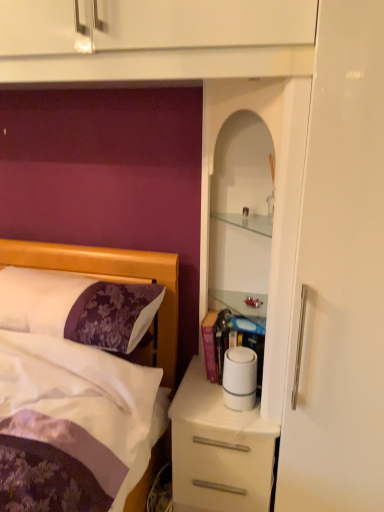
Question: From a real-world perspective, is white glossy cabinet at upper right physically above white matte toilet paper at center?

Choices:
 (A) yes
 (B) no

Answer: (A)

Question: Does white glossy cabinet at upper right lie behind white matte toilet paper at center?

Choices:
 (A) yes
 (B) no

Answer: (B)

Question: Can you confirm if white glossy cabinet at upper right is bigger than white matte toilet paper at center?

Choices:
 (A) yes
 (B) no

Answer: (A)

Question: Does white glossy cabinet at upper right have a greater width compared to white matte toilet paper at center?

Choices:
 (A) no
 (B) yes

Answer: (B)

Question: From the image's perspective, would you say white glossy cabinet at upper right is shown under white matte toilet paper at center?

Choices:
 (A) no
 (B) yes

Answer: (A)

Question: From the image's perspective, is purple satin pillow at left above or below white glossy desk at center?

Choices:
 (A) below
 (B) above

Answer: (B)

Question: Is purple satin pillow at left to the left or to the right of white glossy desk at center in the image?

Choices:
 (A) left
 (B) right

Answer: (A)

Question: In terms of width, does purple satin pillow at left look wider or thinner when compared to white glossy desk at center?

Choices:
 (A) thin
 (B) wide

Answer: (A)

Question: Is purple satin pillow at left in front of or behind white glossy desk at center in the image?

Choices:
 (A) front
 (B) behind

Answer: (A)

Question: In the image, is purple satin pillow at left positioned in front of or behind white matte toilet paper at center?

Choices:
 (A) front
 (B) behind

Answer: (A)

Question: From the image's perspective, is purple satin pillow at left positioned above or below white matte toilet paper at center?

Choices:
 (A) above
 (B) below

Answer: (A)

Question: Is purple satin pillow at left spatially inside white matte toilet paper at center, or outside of it?

Choices:
 (A) inside
 (B) outside

Answer: (B)

Question: From a real-world perspective, is purple satin pillow at left positioned above or below white matte toilet paper at center?

Choices:
 (A) above
 (B) below

Answer: (A)

Question: In the image, is white glossy cabinet at upper right positioned in front of or behind purple satin pillow at left?

Choices:
 (A) front
 (B) behind

Answer: (A)

Question: Considering the positions of white glossy cabinet at upper right and purple satin pillow at left in the image, is white glossy cabinet at upper right taller or shorter than purple satin pillow at left?

Choices:
 (A) tall
 (B) short

Answer: (A)